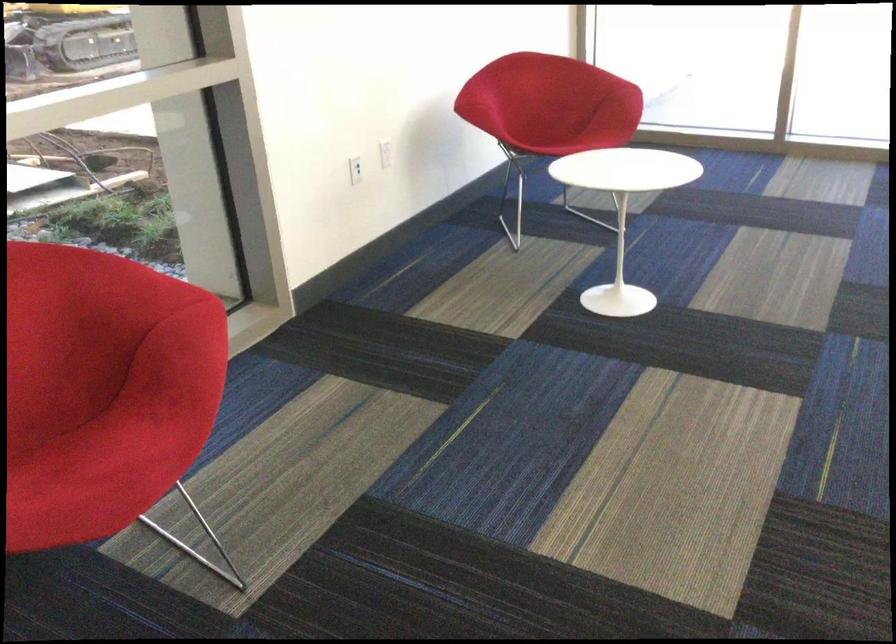
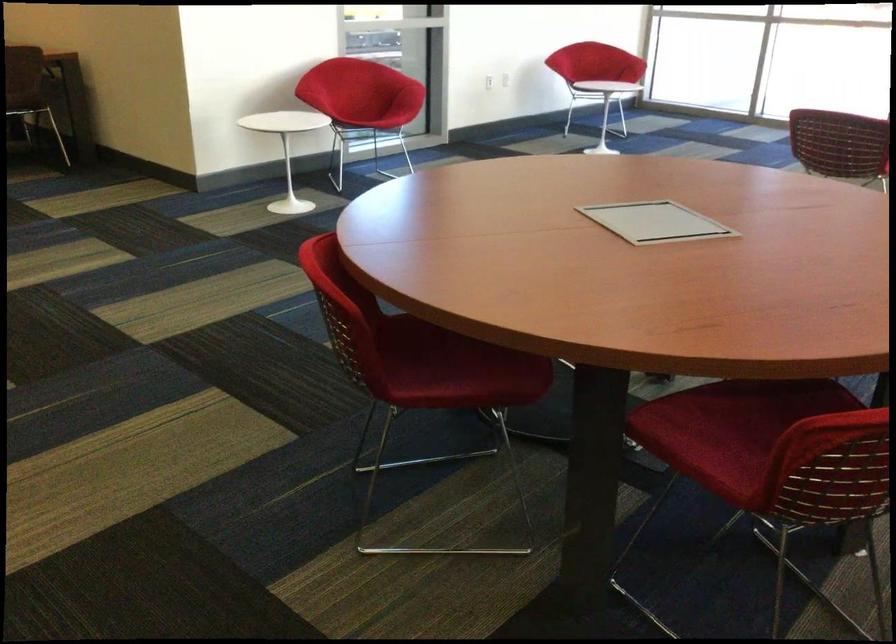
Question: I am providing you with two images of the same scene from different viewpoints. Which of the following objects are not visible in image2?

Choices:
 (A) red chair sitting surface
 (B) white power outlet
 (C) red chair armrest
 (D) yellow and black can

Answer: (B)